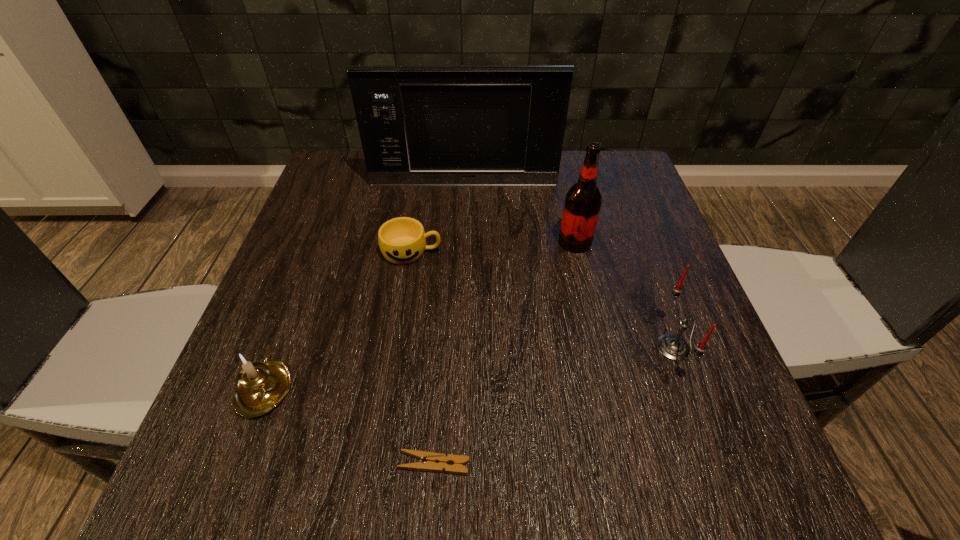
Identify the location of vacant space in between the root beer and the candle holder. The height and width of the screenshot is (540, 960). (420, 314).

Choose which object is the fifth nearest neighbor to the rightmost object. Please provide its 2D coordinates. Your answer should be formatted as a tuple, i.e. [(x, y)], where the tuple contains the x and y coordinates of a point satisfying the conditions above.

[(263, 385)]

Where is `the fourth closest object to the leftmost object`? The width and height of the screenshot is (960, 540). the fourth closest object to the leftmost object is located at coordinates (583, 200).

At what (x,y) coordinates should I click in order to perform the action: click on vacant space that satisfies the following two spatial constraints: 1. on the front side of the cup; 2. on the left side of the clothespin. Please return your answer as a coordinate pair (x, y). This screenshot has width=960, height=540. Looking at the image, I should click on (378, 464).

In order to click on free location that satisfies the following two spatial constraints: 1. on the handle side of the third shortest object; 2. on the right side of the cup in this screenshot , I will do `click(317, 252)`.